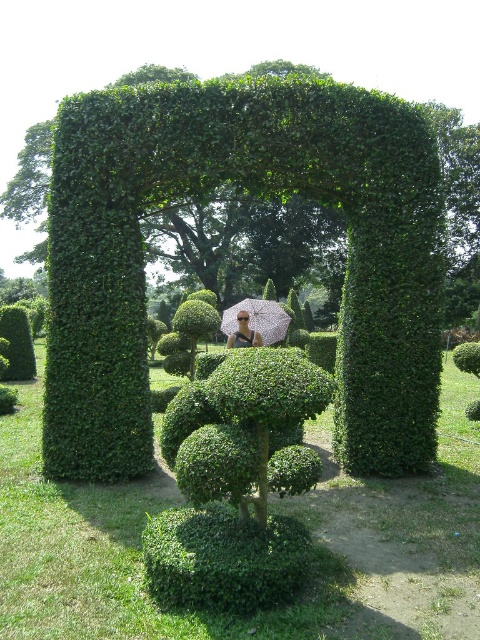
Between green leafy bush at center and matte black umbrella at center, which one has less height?

Standing shorter between the two is matte black umbrella at center.

Does green leafy bush at center appear under matte black umbrella at center?

Indeed, green leafy bush at center is positioned under matte black umbrella at center.

Measure the distance between point (32, 365) and camera.

A distance of 59.93 feet exists between point (32, 365) and camera.

I want to click on green leafy bush at center, so click(x=16, y=342).

Who is positioned more to the left, green leafy bush at center or pink fabric umbrella at center?

From the viewer's perspective, green leafy bush at center appears more on the left side.

Where is `green leafy bush at center`? green leafy bush at center is located at coordinates (16, 342).

Locate an element on the screen. This screenshot has width=480, height=640. green leafy bush at center is located at coordinates (16, 342).

Which is above, pink fabric umbrella at center or matte black umbrella at center?

pink fabric umbrella at center is higher up.

Does pink fabric umbrella at center appear over matte black umbrella at center?

Yes, pink fabric umbrella at center is above matte black umbrella at center.

Which is in front, point (233, 316) or point (248, 326)?

Point (248, 326)

At what (x,y) coordinates should I click in order to perform the action: click on pink fabric umbrella at center. Please return your answer as a coordinate pair (x, y). The image size is (480, 640). Looking at the image, I should click on (259, 320).